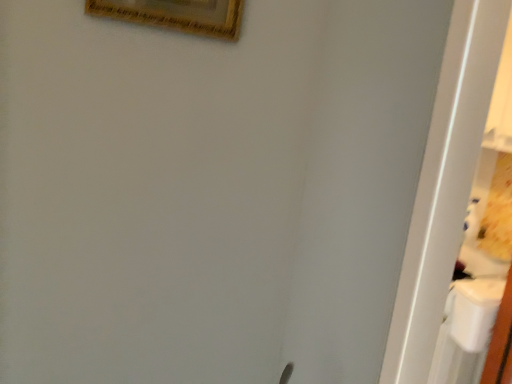
The width and height of the screenshot is (512, 384). Describe the element at coordinates (176, 15) in the screenshot. I see `gold-framed picture at upper left` at that location.

The height and width of the screenshot is (384, 512). Identify the location of gold-framed picture at upper left. (176, 15).

Locate an element on the screen. Image resolution: width=512 pixels, height=384 pixels. gold-framed picture at upper left is located at coordinates (176, 15).